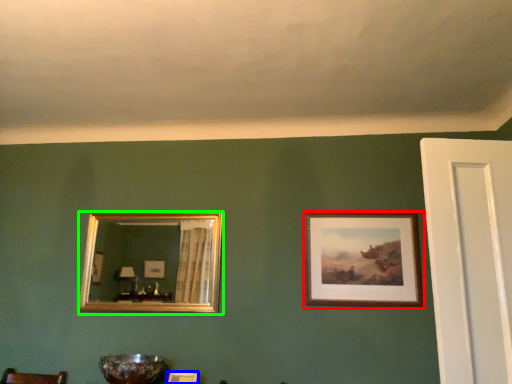
Question: Considering the real-world distances, which object is farthest from picture frame (highlighted by a red box)? picture frame (highlighted by a blue box) or picture frame (highlighted by a green box)?

Choices:
 (A) picture frame
 (B) picture frame

Answer: (B)